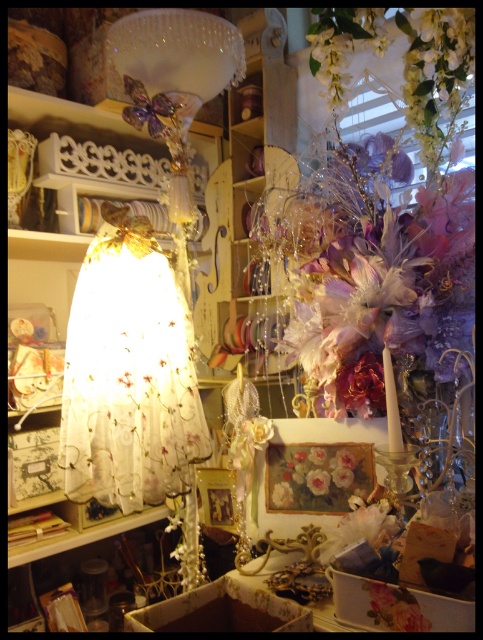
Which of these two, translucent fabric lampshade at left or white lace lampshade at upper center, stands shorter?

white lace lampshade at upper center is shorter.

Measure the distance between point (20, 92) and camera.

1.36 meters

This screenshot has width=483, height=640. I want to click on translucent fabric lampshade at left, so click(x=54, y=241).

Does translucent fabric lampshade at left have a greater width compared to pastel floral painting at center?

Correct, the width of translucent fabric lampshade at left exceeds that of pastel floral painting at center.

Consider the image. Is translucent fabric lampshade at left shorter than pastel floral painting at center?

No.

What do you see at coordinates (54, 241) in the screenshot? The image size is (483, 640). I see `translucent fabric lampshade at left` at bounding box center [54, 241].

The width and height of the screenshot is (483, 640). In order to click on translucent fabric lampshade at left in this screenshot , I will do `click(54, 241)`.

Based on the photo, does white lace lampshade at upper center have a lesser height compared to pastel floral painting at center?

No.

Is white lace lampshade at upper center above pastel floral painting at center?

Yes.

Between point (221, 45) and point (342, 467), which one is positioned behind?

Positioned behind is point (221, 45).

Image resolution: width=483 pixels, height=640 pixels. Find the location of `white lace lampshade at upper center`. white lace lampshade at upper center is located at coordinates (173, 80).